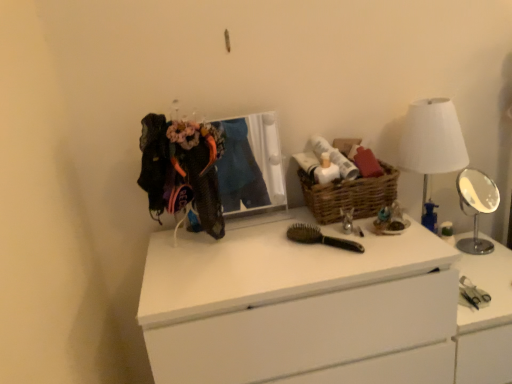
This screenshot has width=512, height=384. What are the coordinates of `free space that is to the left of knitted fabric clothesline at upper left` in the screenshot? It's located at (162, 241).